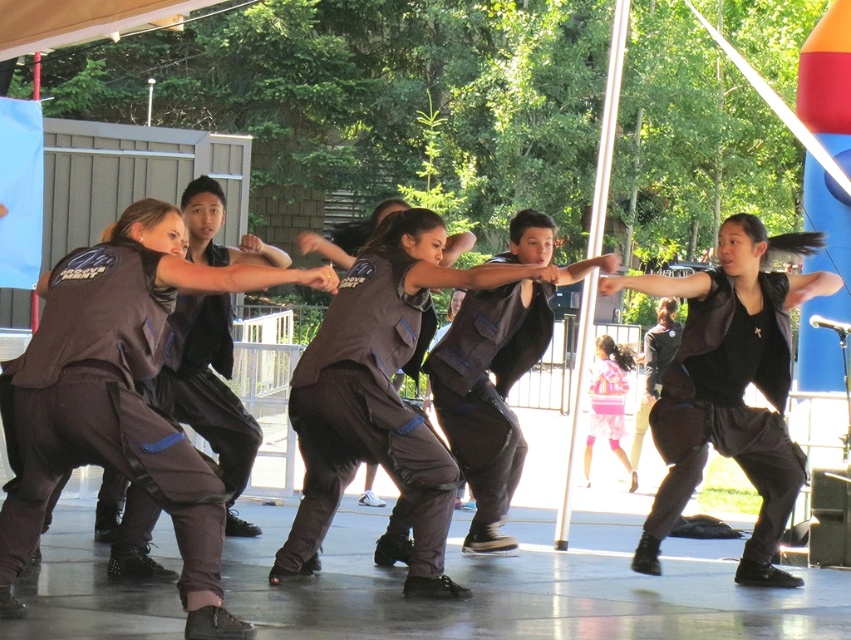
You are a photographer trying to capture the performers. You notice two performers wearing matte black vest at center and black matte vest at center. Which one is positioned closer to the camera?

The matte black vest at center is positioned closer to the viewer than the black matte vest at center.

You are a photographer trying to capture the performers in the image. You notice two similar looking vests in the scene. The matte black vest at center and the black matte vest at center. Which one is wider?

The matte black vest at center is wider than the black matte vest at center according to the description.